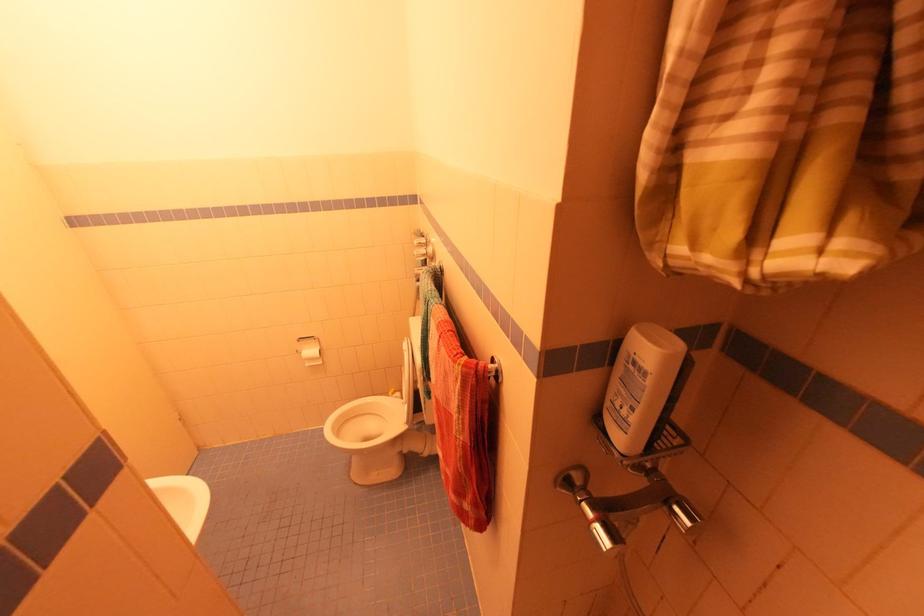
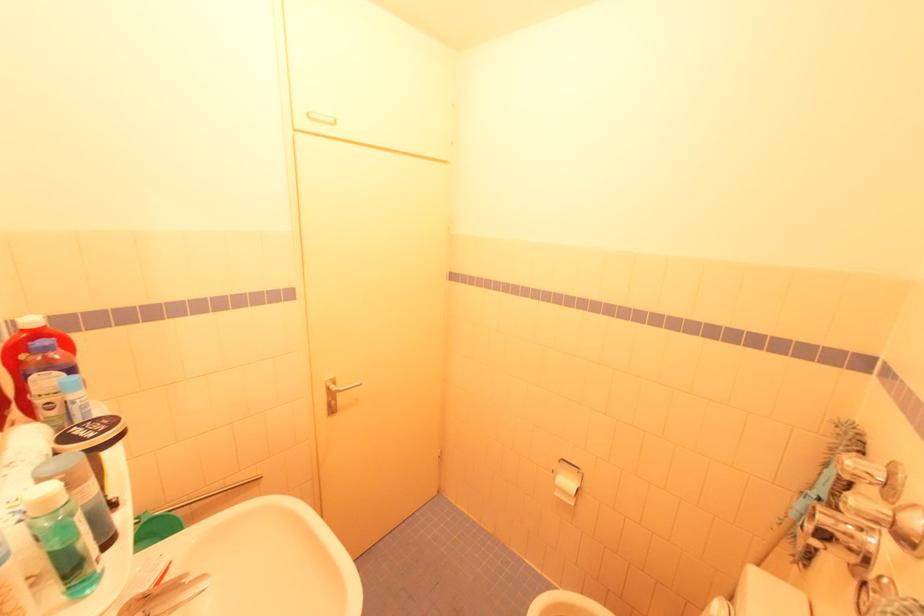
Question: The camera is either moving clockwise (left) or counter-clockwise (right) around the object. The first image is from the beginning of the video and the second image is from the end. Is the camera moving left or right when shooting the video?

Choices:
 (A) Left
 (B) Right

Answer: (B)